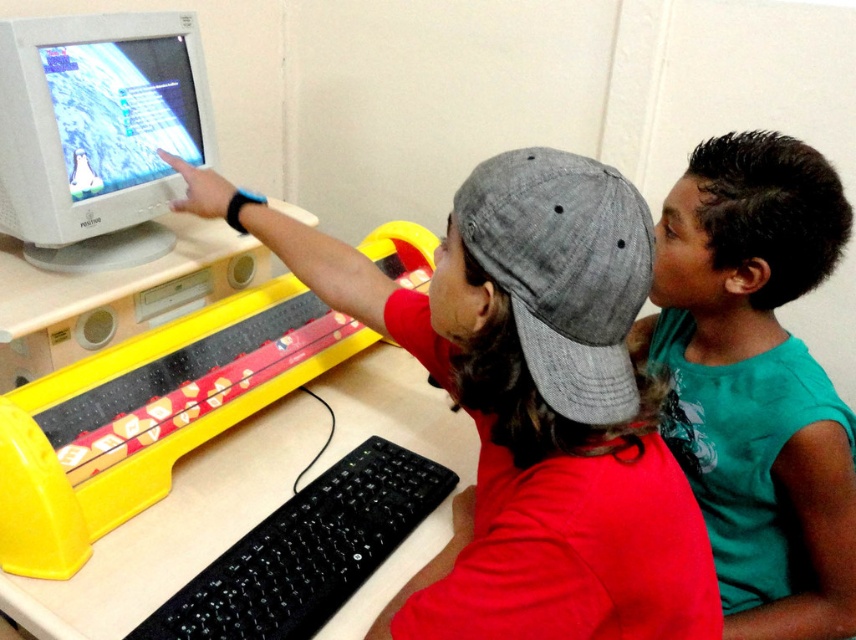
Question: Which object is farther from the camera taking this photo?

Choices:
 (A) black plastic keyboard at lower center
 (B) green matte shirt at right

Answer: (B)

Question: Among these objects, which one is farthest from the camera?

Choices:
 (A) yellow plastic video game at left
 (B) black plastic keyboard at lower center
 (C) white glossy computer monitor at upper left
 (D) matte gray cap at upper center

Answer: (C)

Question: Is matte gray cap at upper center positioned in front of yellow plastic video game at left?

Choices:
 (A) no
 (B) yes

Answer: (B)

Question: Which point is closer to the camera taking this photo?

Choices:
 (A) (131, 74)
 (B) (200, 356)

Answer: (B)

Question: Does matte gray cap at upper center appear on the right side of green matte shirt at right?

Choices:
 (A) yes
 (B) no

Answer: (B)

Question: Is yellow plastic video game at left wider than black plastic keyboard at lower center?

Choices:
 (A) no
 (B) yes

Answer: (B)